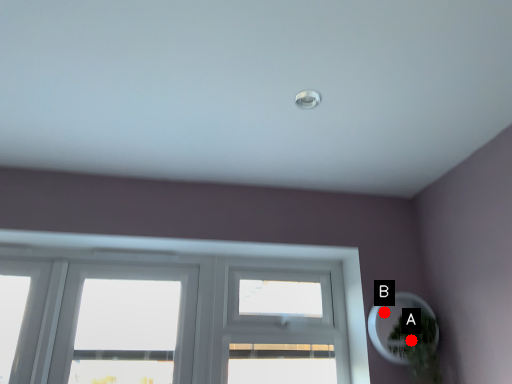
Question: Two points are circled on the image, labeled by A and B beside each circle. Which point is farther to the camera?

Choices:
 (A) A is further
 (B) B is further

Answer: (B)